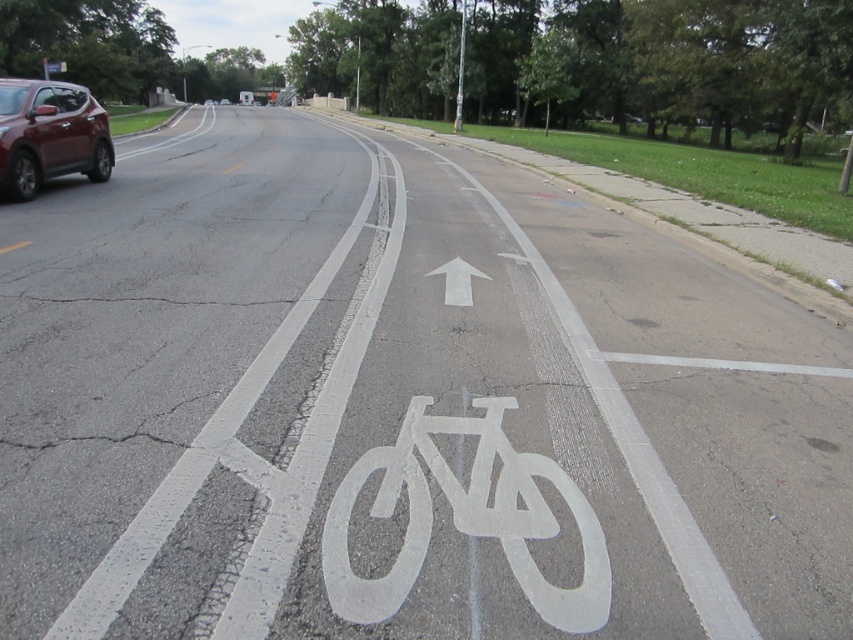
Question: Which point is closer to the camera?

Choices:
 (A) (22, 189)
 (B) (527, 547)

Answer: (B)

Question: Which point is farther to the camera?

Choices:
 (A) (1, 116)
 (B) (404, 480)

Answer: (A)

Question: Can you confirm if white painted bicycle at center is wider than matte red suv at left?

Choices:
 (A) no
 (B) yes

Answer: (B)

Question: Which point is farther from the camera taking this photo?

Choices:
 (A) (514, 577)
 (B) (51, 122)

Answer: (B)

Question: Is white painted bicycle at center wider than matte red suv at left?

Choices:
 (A) no
 (B) yes

Answer: (B)

Question: Does white painted bicycle at center have a smaller size compared to matte red suv at left?

Choices:
 (A) no
 (B) yes

Answer: (B)